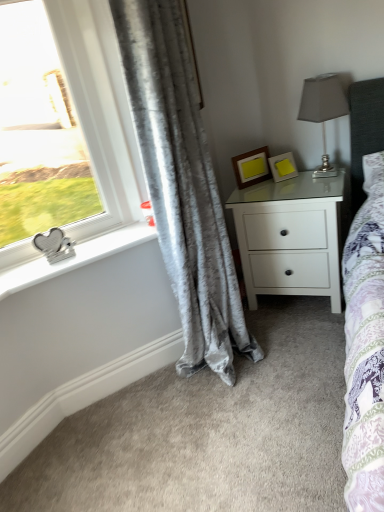
Identify the location of vacant area situated below satin silver table lamp at upper right (from a real-world perspective). The image size is (384, 512). (326, 178).